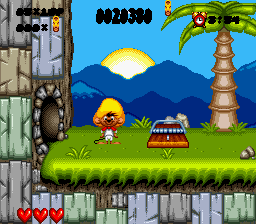
This screenshot has height=224, width=256. Identify the location of mouse. (109, 123).